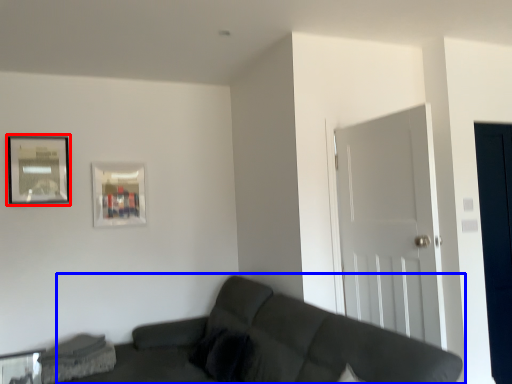
Question: Which object is closer to the camera taking this photo, picture frame (highlighted by a red box) or studio couch (highlighted by a blue box)?

Choices:
 (A) picture frame
 (B) studio couch

Answer: (B)